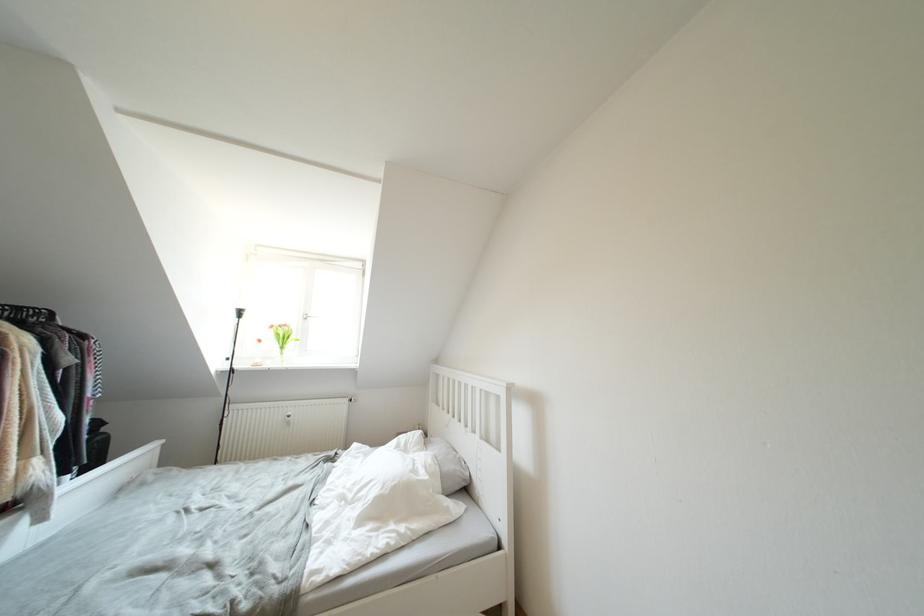
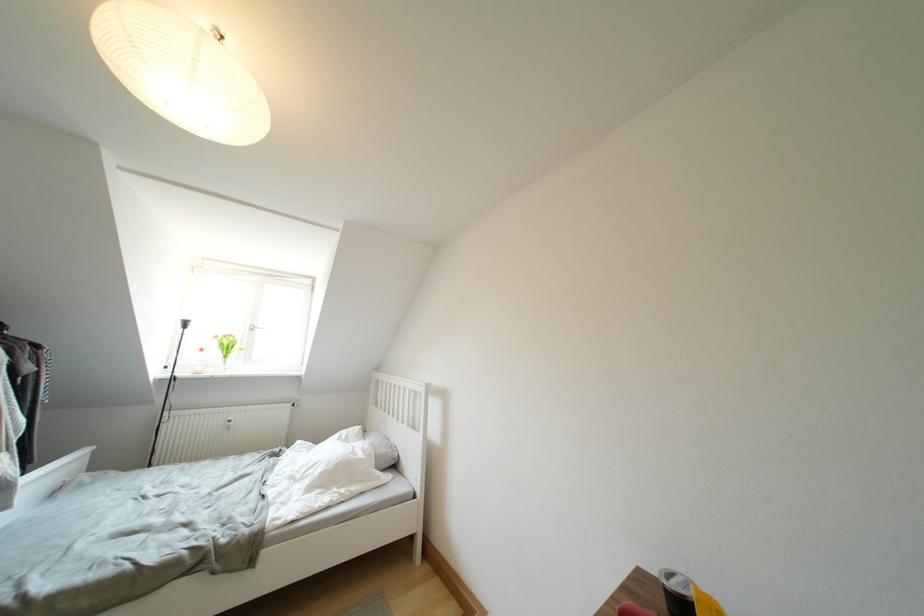
Locate, in the second image, the point that corresponds to point 276,331 in the first image.

(222, 341)